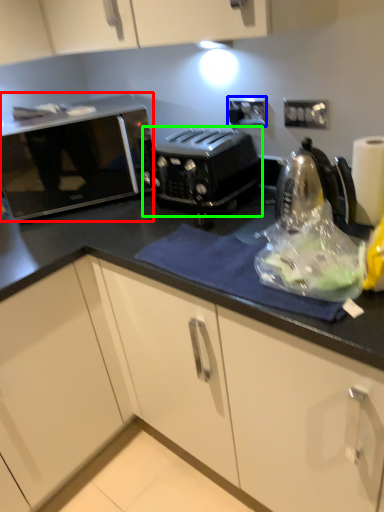
Question: Based on their relative distances, which object is nearer to home appliance (highlighted by a red box)? Choose from electric outlet (highlighted by a blue box) and toaster (highlighted by a green box).

Choices:
 (A) electric outlet
 (B) toaster

Answer: (B)